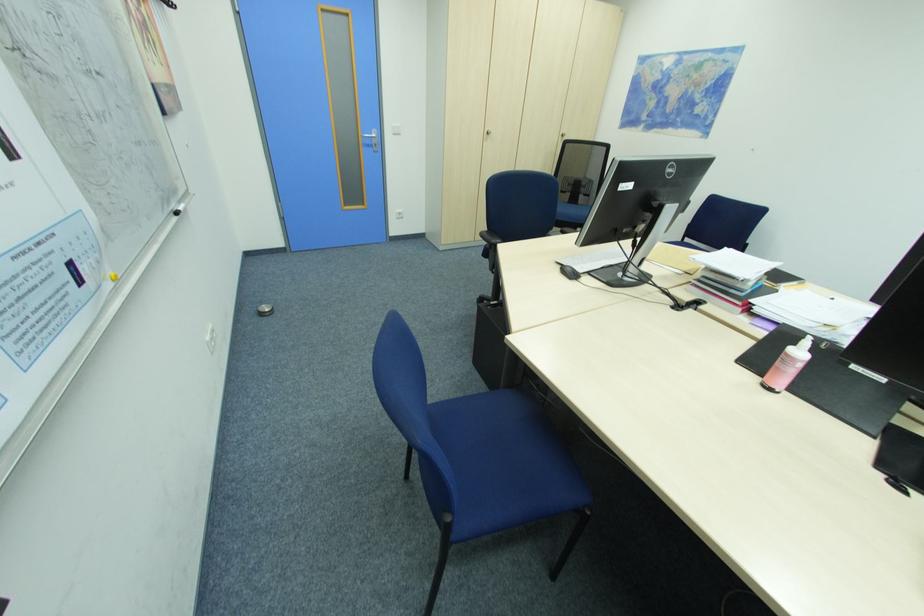
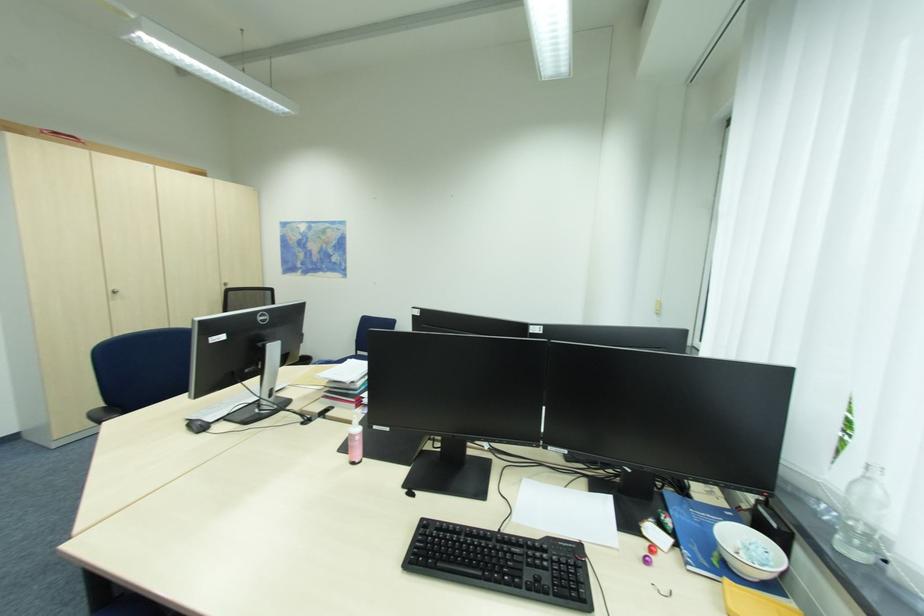
Question: The first image is from the beginning of the video and the second image is from the end. How did the camera likely rotate when shooting the video?

Choices:
 (A) Left
 (B) Right
 (C) Up
 (D) Down

Answer: (B)